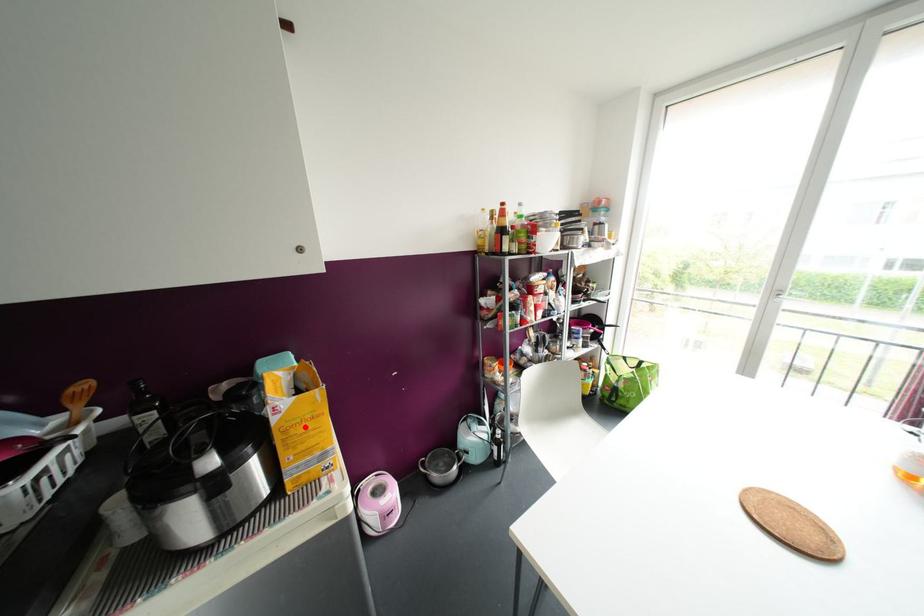
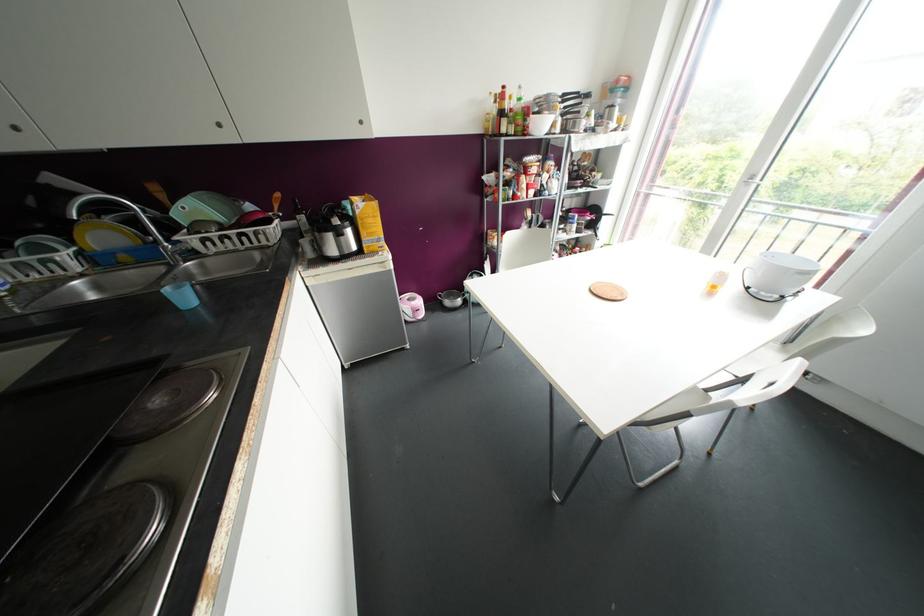
Question: I am providing you with two images of the same scene from different viewpoints. In image1, a red point is highlighted. Considering the same 3D point in image2, which of the following is correct?

Choices:
 (A) It is closer
 (B) It is farther

Answer: (A)